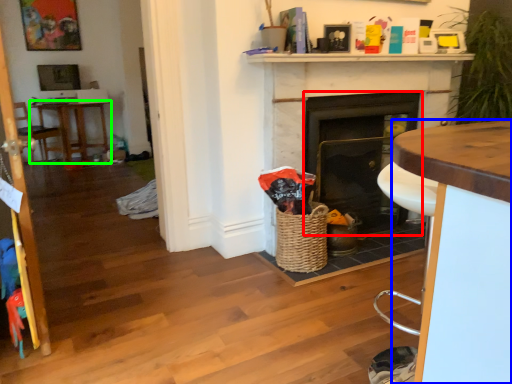
Question: Which object is positioned closest to fireplace (highlighted by a red box)? Select from desk (highlighted by a blue box) and table (highlighted by a green box).

Choices:
 (A) desk
 (B) table

Answer: (A)